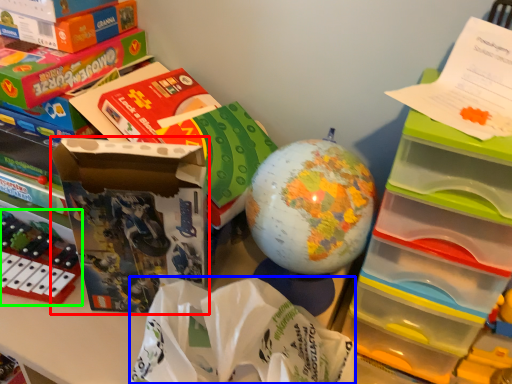
Question: Which object is the farthest from storage box (highlighted by a red box)? Choose among these: paper bag (highlighted by a blue box) or toy (highlighted by a green box).

Choices:
 (A) paper bag
 (B) toy

Answer: (B)